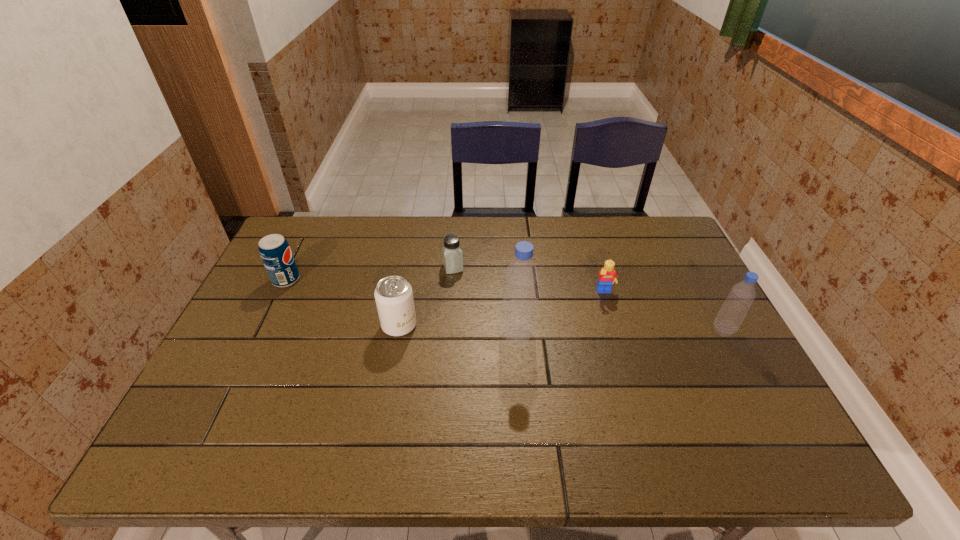
Considering the uniform spacing of bottles, where should an additional bottle be positioned on the left? Please locate a free spot. Please provide its 2D coordinates. Your answer should be formatted as a tuple, i.e. [(x, y)], where the tuple contains the x and y coordinates of a point satisfying the conditions above.

[(307, 339)]